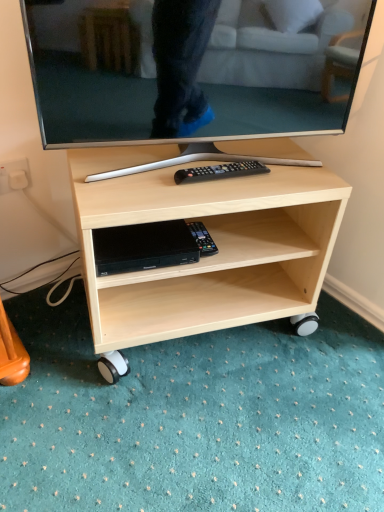
At what (x,y) coordinates should I click in order to perform the action: click on vacant point to the right of black plastic remote at center. Please return your answer as a coordinate pair (x, y). The width and height of the screenshot is (384, 512). Looking at the image, I should click on (291, 178).